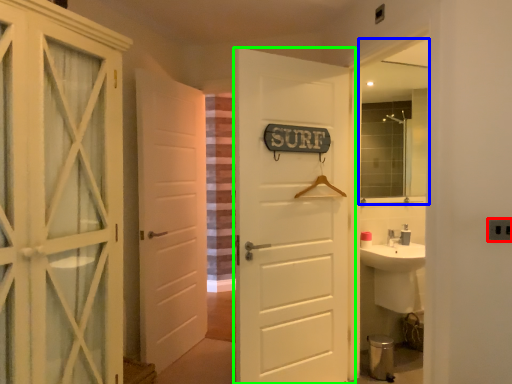
Question: Which object is the farthest from electric outlet (highlighted by a red box)? Choose among these: mirror (highlighted by a blue box) or door (highlighted by a green box).

Choices:
 (A) mirror
 (B) door

Answer: (A)